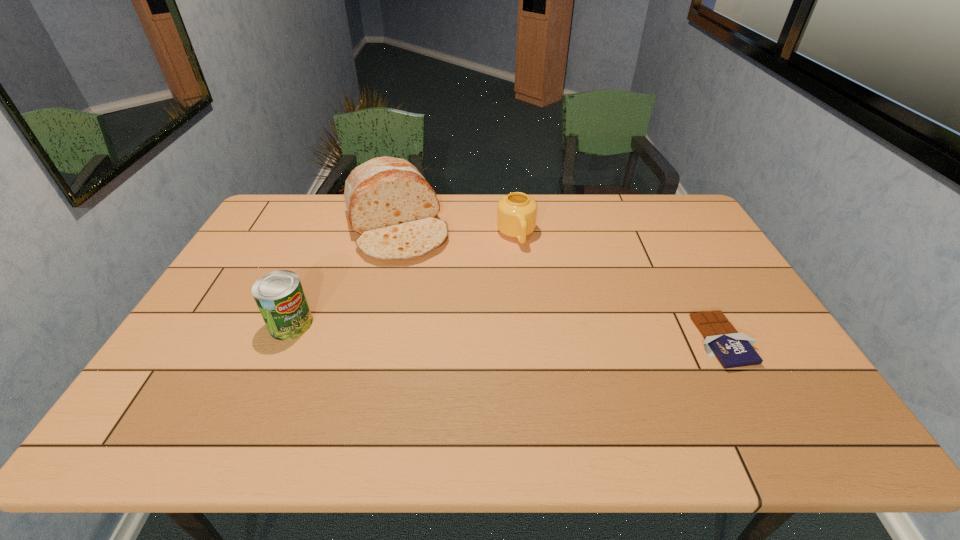
Image resolution: width=960 pixels, height=540 pixels. Identify the location of vacant space on the desktop that is between the can and the rightmost object and is positioned on the handle side of the third object from left to right. (550, 334).

Where is `free spot on the desktop that is between the can and the shortest object and is positioned at the sliced end of the tallest object`? free spot on the desktop that is between the can and the shortest object and is positioned at the sliced end of the tallest object is located at coordinates (444, 330).